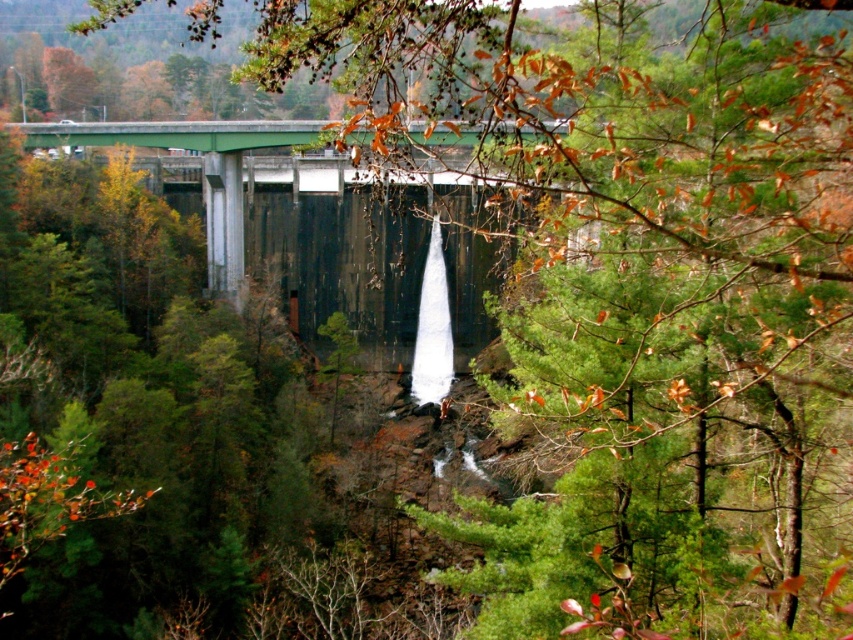
You are standing at the base of the dam and want to reach a specific point marked as point (283, 179). If you walk straight ahead, will you reach this point within 100 meters?

The point (283, 179) is 93.41 meters away from the viewer, so yes, you can reach it within 100 meters by walking straight ahead.

You are a delivery truck driver who needs to cross the green concrete bridge at center. However, your truck has a height of 13 feet. The white frothy water at center is flowing below the bridge. Can your truck safely pass under the bridge without hitting the water?

The green concrete bridge at center and white frothy water at center are 33.00 feet apart from each other. Since the truck is only 13 feet tall, there is ample clearance between the bridge and the water, so the truck can safely pass under the bridge without hitting the water.